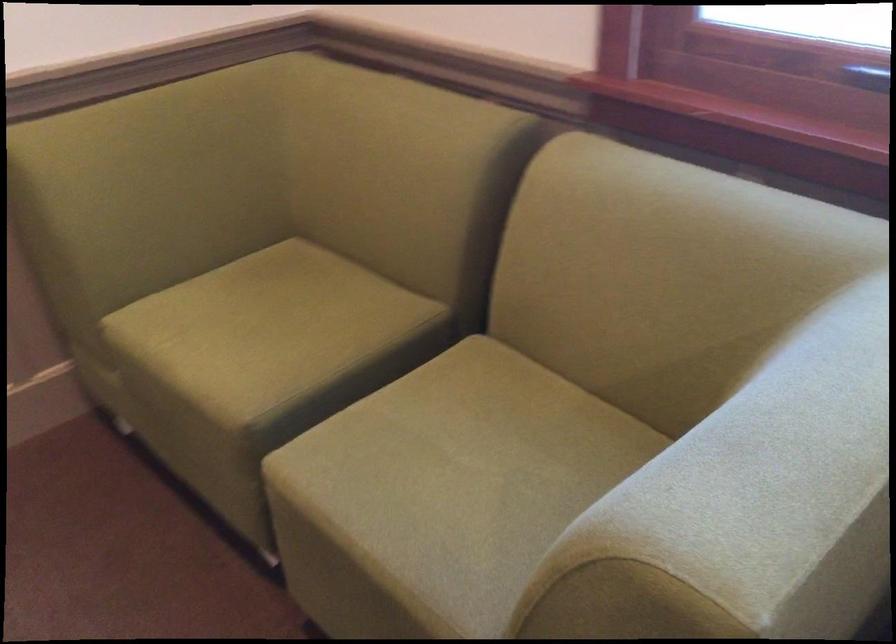
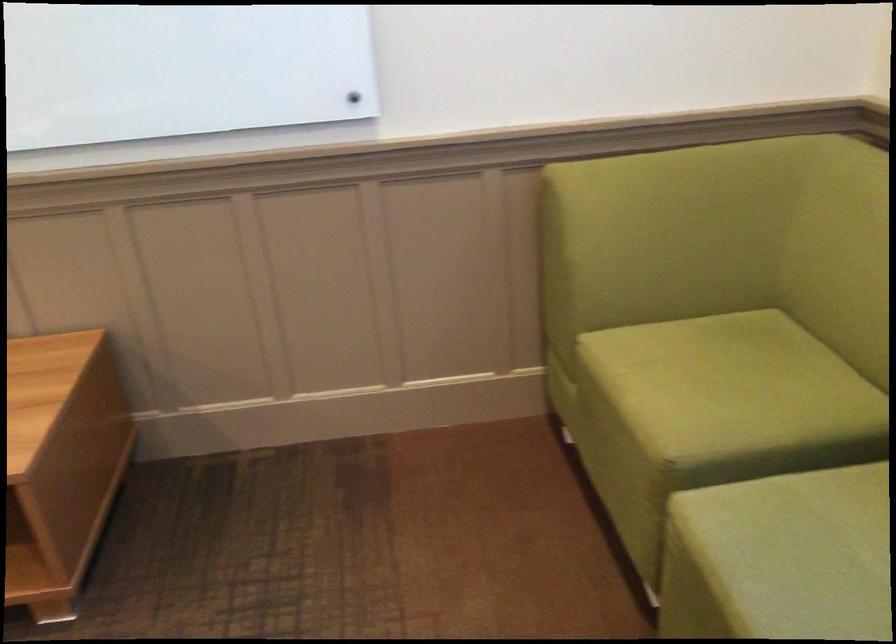
Find the pixel in the second image that matches point 280,330 in the first image.

(727, 384)